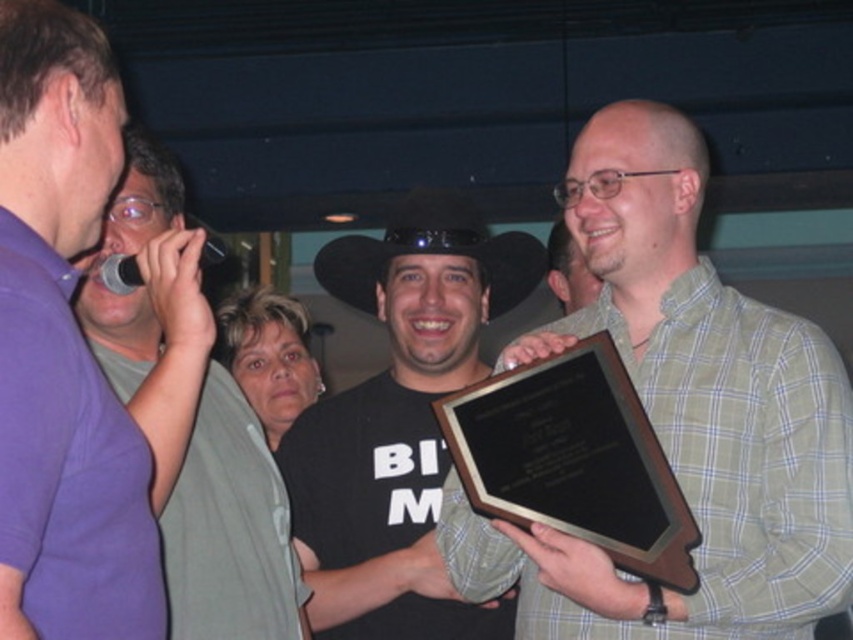
Question: Which point is farther to the camera?

Choices:
 (A) (549, 534)
 (B) (439, 404)
 (C) (431, 250)

Answer: (C)

Question: Is purple shirt at left wider than green plaid shirt at upper right?

Choices:
 (A) yes
 (B) no

Answer: (A)

Question: Is green plaid shirt at center below green plaid shirt at upper right?

Choices:
 (A) yes
 (B) no

Answer: (A)

Question: Which of the following is the farthest from the observer?

Choices:
 (A) green plaid shirt at upper right
 (B) black matte cowboy hat at center
 (C) green plaid shirt at center

Answer: (A)

Question: Is the position of green plaid shirt at center less distant than that of green plaid shirt at upper right?

Choices:
 (A) yes
 (B) no

Answer: (A)

Question: Among these objects, which one is nearest to the camera?

Choices:
 (A) green plaid shirt at upper right
 (B) black matte cowboy hat at center
 (C) purple shirt at left
 (D) black felt cowboy hat at center

Answer: (C)